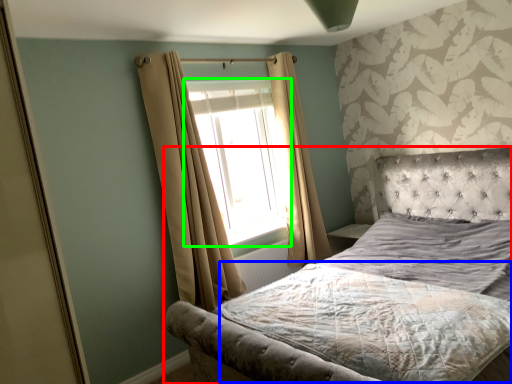
Question: Considering the real-world distances, which object is closest to bed (highlighted by a red box)? mattress (highlighted by a blue box) or window (highlighted by a green box).

Choices:
 (A) mattress
 (B) window

Answer: (A)